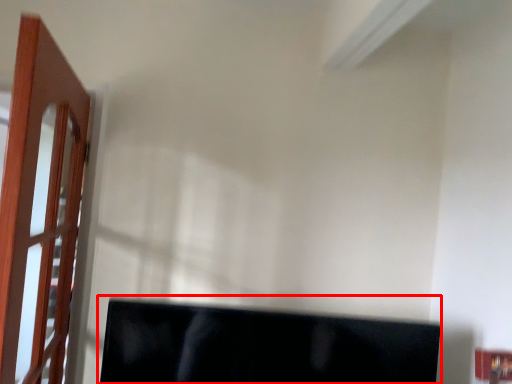
Question: Observing the image, what is the correct spatial positioning of computer monitor (annotated by the red box) in reference to door?

Choices:
 (A) left
 (B) right

Answer: (B)